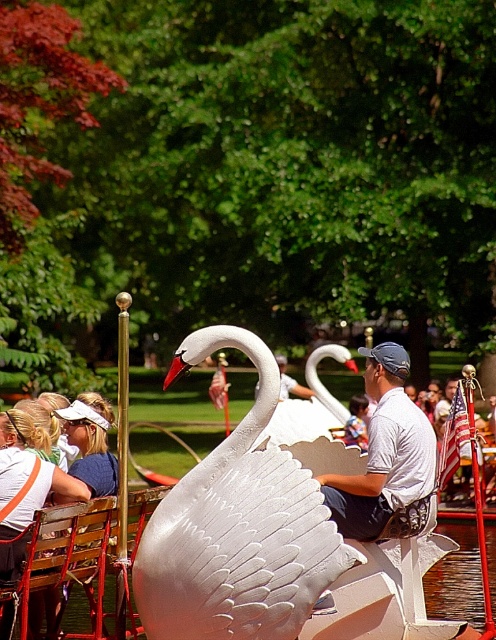
You are a visitor in the park and want to take a photo of the white glossy swan at center from the wooden chair at lower left. Can you comfortably sit on the chair and take a clear photo of the swan without moving from your seat?

The white glossy swan at center is 5.48 meters away from the wooden chair at lower left. Since the distance is more than sufficient for a clear photo, you can comfortably sit on the wooden chair at lower left and take a clear photo of the white glossy swan at center without needing to move.

You are planning to place a new bench in the park that must be wider than the existing wooden chair at lower left. Can the white matte swan at center be used as a reference to ensure the bench will fit? Explain your reasoning.

The white matte swan at center is wider than the wooden chair at lower left. Since the bench needs to be wider than the wooden chair at lower left, using the white matte swan at center as a reference would ensure the bench meets the required width.